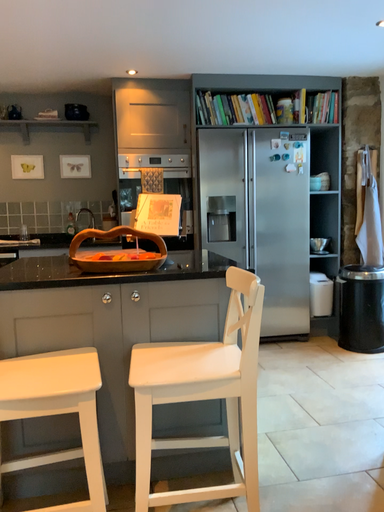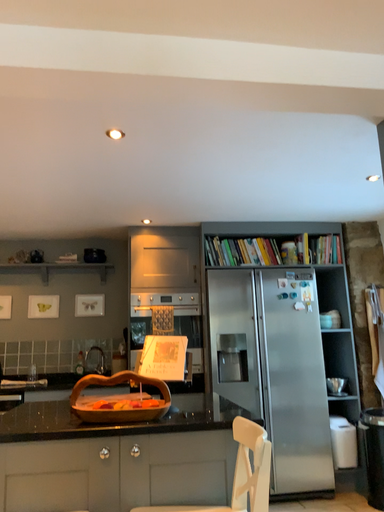
Question: Which way did the camera rotate in the video?

Choices:
 (A) rotated downward
 (B) rotated upward

Answer: (B)